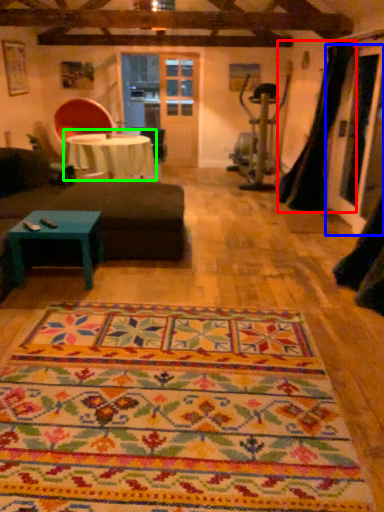
Question: Based on their relative distances, which object is farther from curtain (highlighted by a red box)? Choose from glass door (highlighted by a blue box) and table (highlighted by a green box).

Choices:
 (A) glass door
 (B) table

Answer: (B)